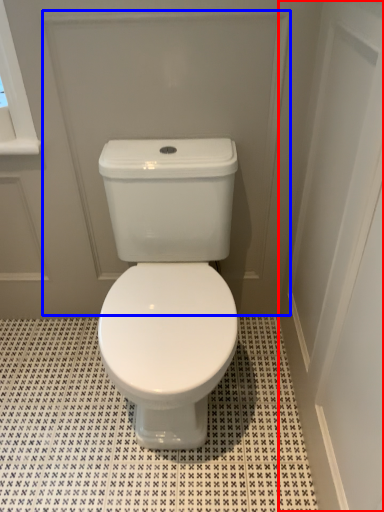
Question: Which object appears farthest to the camera in this image, screen door (highlighted by a red box) or screen door (highlighted by a blue box)?

Choices:
 (A) screen door
 (B) screen door

Answer: (B)